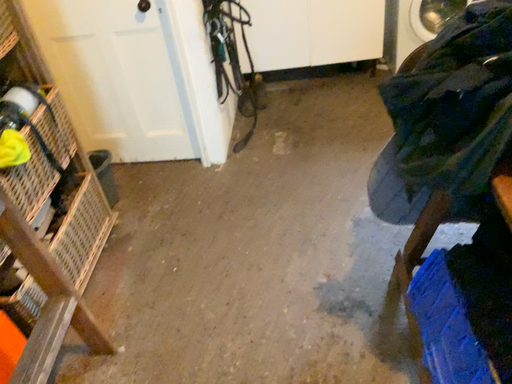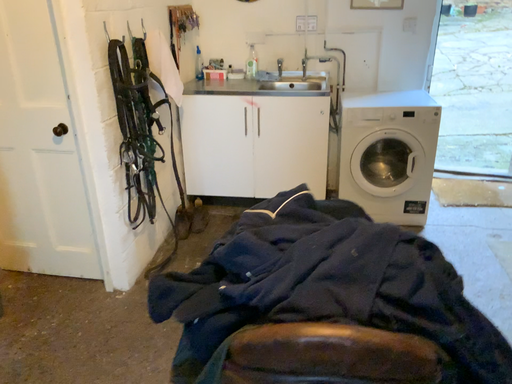
Question: Which way did the camera rotate in the video?

Choices:
 (A) rotated downward
 (B) rotated upward

Answer: (B)